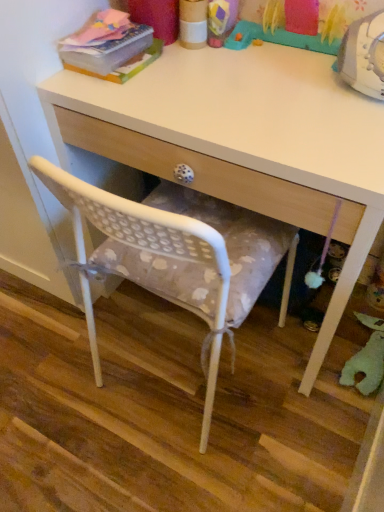
The height and width of the screenshot is (512, 384). I want to click on vacant position to the left of green felt toy at lower right, which is the 2th toy in left-to-right order, so (291, 362).